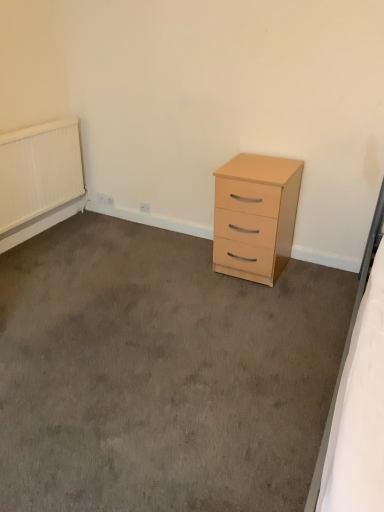
At what (x,y) coordinates should I click in order to perform the action: click on free point above light wood/finish chest of drawers at center-right (from a real-world perspective). Please return your answer as a coordinate pair (x, y). This screenshot has height=512, width=384. Looking at the image, I should click on (258, 164).